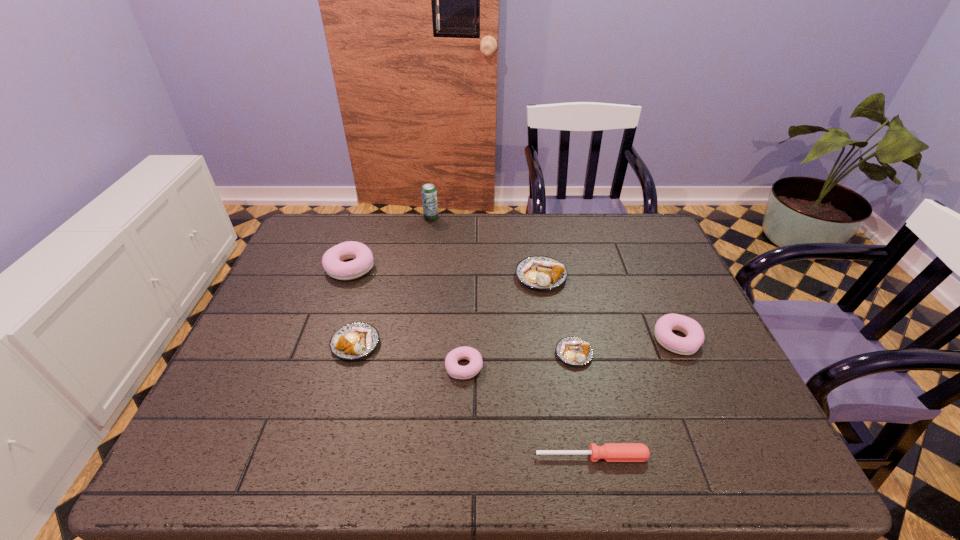
Where is `the tallest object`? The width and height of the screenshot is (960, 540). the tallest object is located at coordinates (429, 194).

Locate an element on the screen. Image resolution: width=960 pixels, height=540 pixels. the farthest object is located at coordinates (429, 194).

In order to click on the biggest pink pastry in this screenshot , I will do `click(332, 260)`.

Image resolution: width=960 pixels, height=540 pixels. I want to click on the leftmost pink pastry, so click(332, 260).

Identify the location of the biggest brown pastry. Image resolution: width=960 pixels, height=540 pixels. (538, 272).

The height and width of the screenshot is (540, 960). In order to click on the rightmost pastry in this screenshot , I will do click(x=688, y=345).

Identify the location of the rightmost object. (688, 345).

Find the location of a particular element. the leftmost brown pastry is located at coordinates (353, 341).

Locate an element on the screen. This screenshot has height=540, width=960. the second pink pastry from right to left is located at coordinates (456, 371).

In order to click on the smallest pink pastry in this screenshot , I will do `click(456, 371)`.